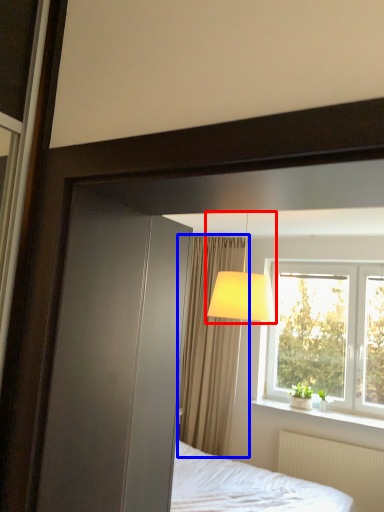
Question: Which object is further to the camera taking this photo, table lamp (highlighted by a red box) or curtain (highlighted by a blue box)?

Choices:
 (A) table lamp
 (B) curtain

Answer: (B)